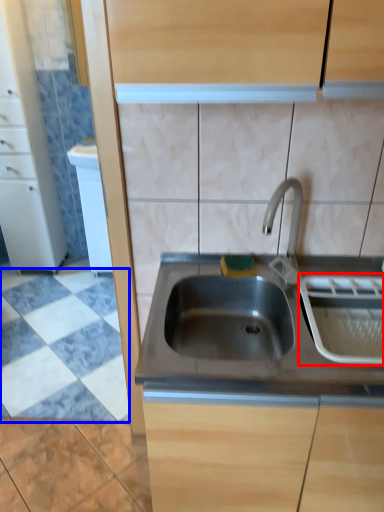
Question: Which object is further to the camera taking this photo, appliance (highlighted by a red box) or ceramic tile (highlighted by a blue box)?

Choices:
 (A) appliance
 (B) ceramic tile

Answer: (B)